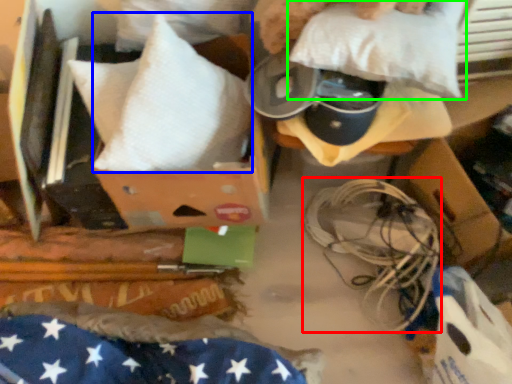
Question: Which is farther away from wire (highlighted by a red box)? pillow (highlighted by a blue box) or pillow (highlighted by a green box)?

Choices:
 (A) pillow
 (B) pillow

Answer: (A)